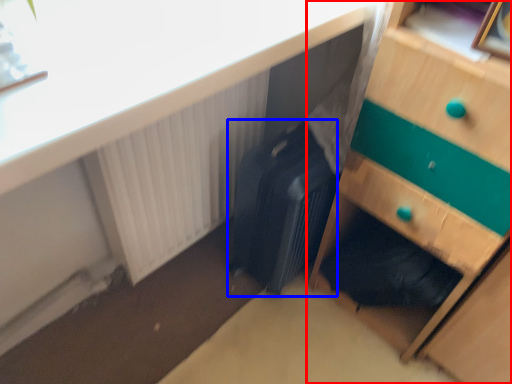
Question: Which of the following is the farthest to the observer, chest of drawers (highlighted by a red box) or luggage (highlighted by a blue box)?

Choices:
 (A) chest of drawers
 (B) luggage

Answer: (B)